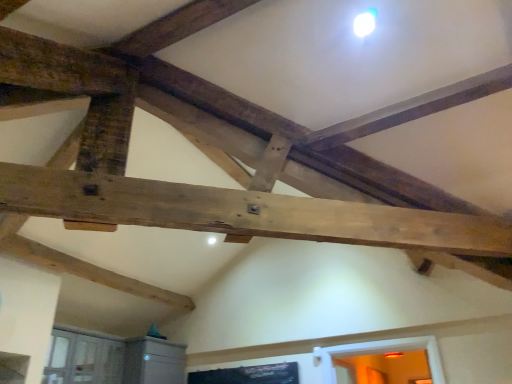
The width and height of the screenshot is (512, 384). In order to click on matte gray cabinet at lower left in this screenshot , I will do `click(83, 358)`.

What is the approximate width of matte gray cabinet at lower left?

It is 16.07 inches.

The height and width of the screenshot is (384, 512). What do you see at coordinates (83, 358) in the screenshot?
I see `matte gray cabinet at lower left` at bounding box center [83, 358].

This screenshot has height=384, width=512. What are the coordinates of `matte gray cabinet at lower left` in the screenshot? It's located at (83, 358).